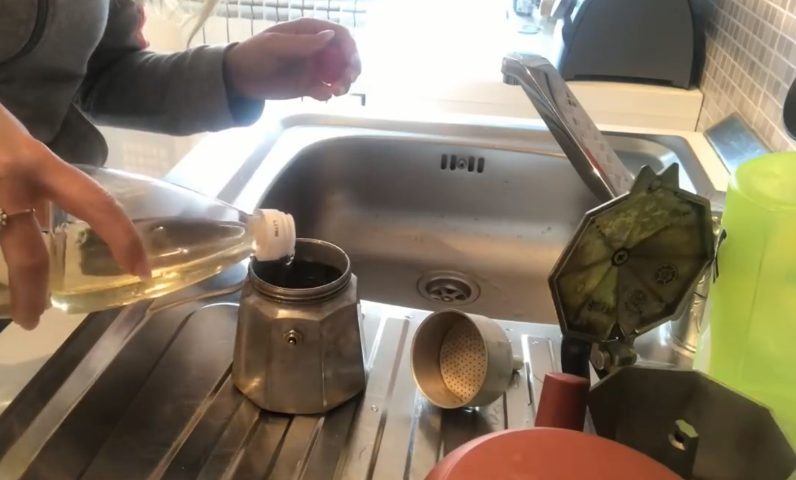
Find the location of a particular element. The image size is (796, 480). silver sink is located at coordinates (387, 221).